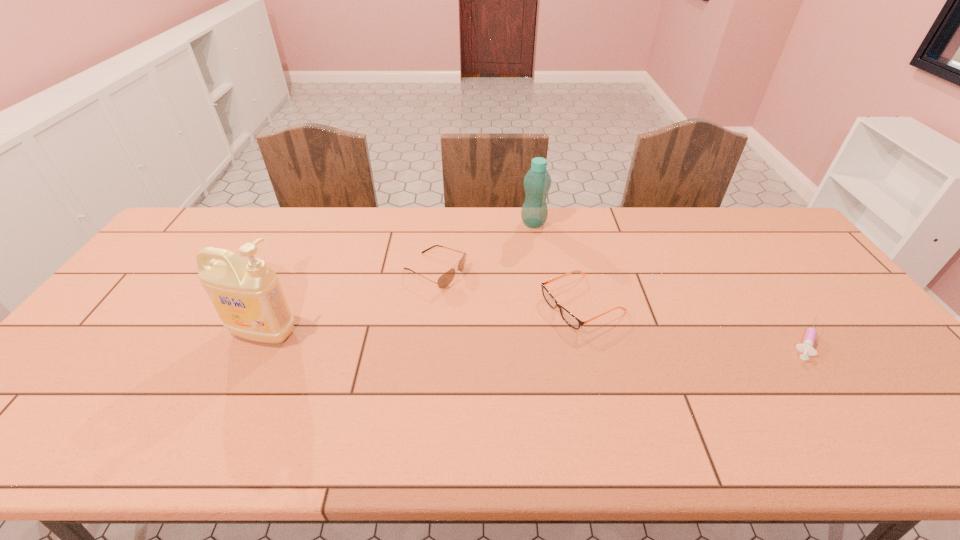
Image resolution: width=960 pixels, height=540 pixels. Find the location of `the tallest object`. the tallest object is located at coordinates (247, 295).

In order to click on the leftmost object in this screenshot , I will do `click(247, 295)`.

Identify the location of the rightmost object. (807, 347).

Where is `the shortest object`? This screenshot has width=960, height=540. the shortest object is located at coordinates (807, 347).

Locate an element on the screen. This screenshot has width=960, height=540. the fourth object from right to left is located at coordinates (444, 280).

Locate an element on the screen. The width and height of the screenshot is (960, 540). the third tallest object is located at coordinates (444, 280).

This screenshot has height=540, width=960. In order to click on water bottle in this screenshot , I will do `click(537, 182)`.

The image size is (960, 540). In order to click on the farthest object in this screenshot , I will do `click(537, 182)`.

Where is `the fourth tallest object`? the fourth tallest object is located at coordinates point(570,319).

You are a GUI agent. You are given a task and a screenshot of the screen. Output one action in this format:
    pyautogui.click(x=<x>, y=<y>)
    Task: Click on the free space located on the back of the detergent
    Image resolution: width=960 pixels, height=540 pixels.
    Given the screenshot: What is the action you would take?
    pyautogui.click(x=303, y=249)